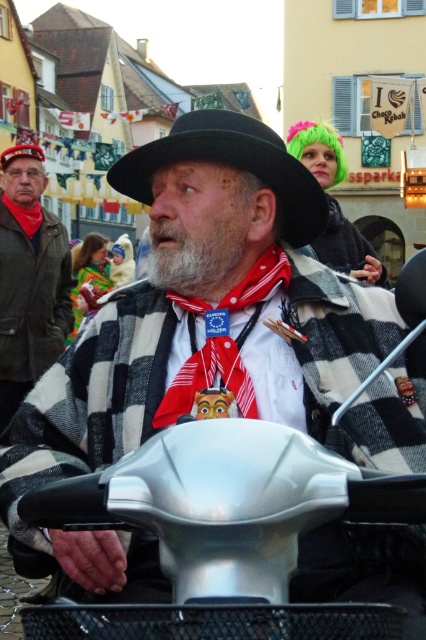
Question: Can you confirm if matte black jacket at left is positioned to the right of graywoollybeard at center?

Choices:
 (A) no
 (B) yes

Answer: (A)

Question: Among these points, which one is nearest to the camera?

Choices:
 (A) (164, 227)
 (B) (169, 134)
 (C) (29, 150)
 (D) (71, 326)

Answer: (A)

Question: Considering the relative positions of matte black jacket at left and black felt hat at upper center in the image provided, where is matte black jacket at left located with respect to black felt hat at upper center?

Choices:
 (A) left
 (B) right

Answer: (B)

Question: Does black felt hat at center appear on the left side of black felt hat at upper center?

Choices:
 (A) no
 (B) yes

Answer: (A)

Question: Which point is farther to the camera?

Choices:
 (A) black felt hat at upper center
 (B) matte black jacket at left
 (C) graywoollybeard at center
 (D) black felt hat at center

Answer: (A)

Question: Among these objects, which one is nearest to the camera?

Choices:
 (A) matte black jacket at left
 (B) black felt hat at upper center

Answer: (A)